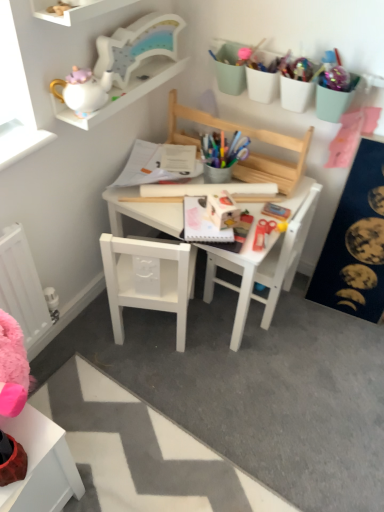
The width and height of the screenshot is (384, 512). In order to click on vacant area to the left of dark blue fabric bulletin board at right in this screenshot , I will do `click(297, 318)`.